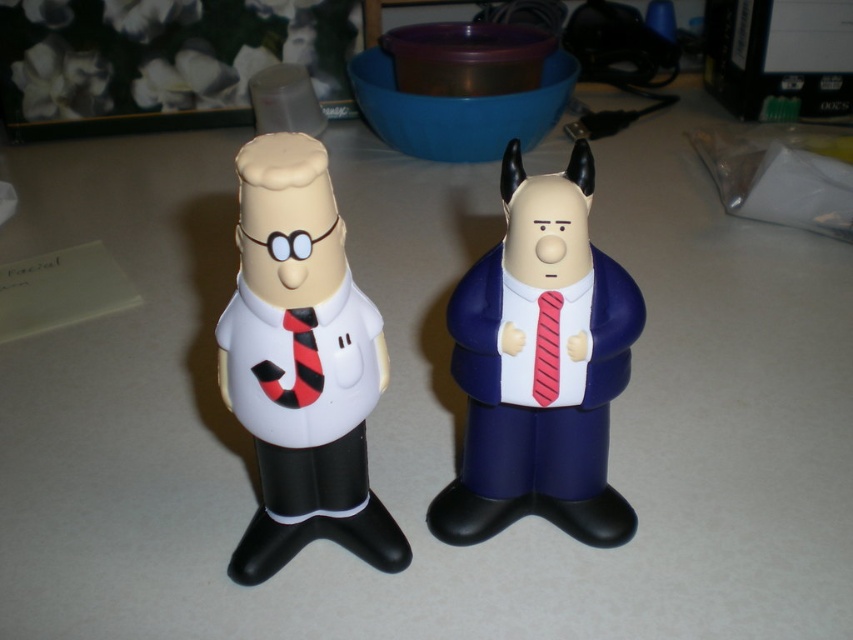
Question: Does matte white figure at center appear on the right side of black/red striped tie at center?

Choices:
 (A) no
 (B) yes

Answer: (A)

Question: Is rubberized blue suit at right above matte white figure at center?

Choices:
 (A) no
 (B) yes

Answer: (B)

Question: Which point is farther from the camera taking this photo?

Choices:
 (A) (543, 340)
 (B) (608, 374)
 (C) (318, 380)

Answer: (B)

Question: Which object appears closest to the camera in this image?

Choices:
 (A) rubberized blue suit at right
 (B) matte white figure at center
 (C) red striped tie at right

Answer: (B)

Question: In this image, where is black/red striped tie at center located relative to red striped tie at right?

Choices:
 (A) above
 (B) below

Answer: (B)

Question: Which of the following is the farthest from the observer?

Choices:
 (A) (512, 289)
 (B) (299, 310)

Answer: (A)